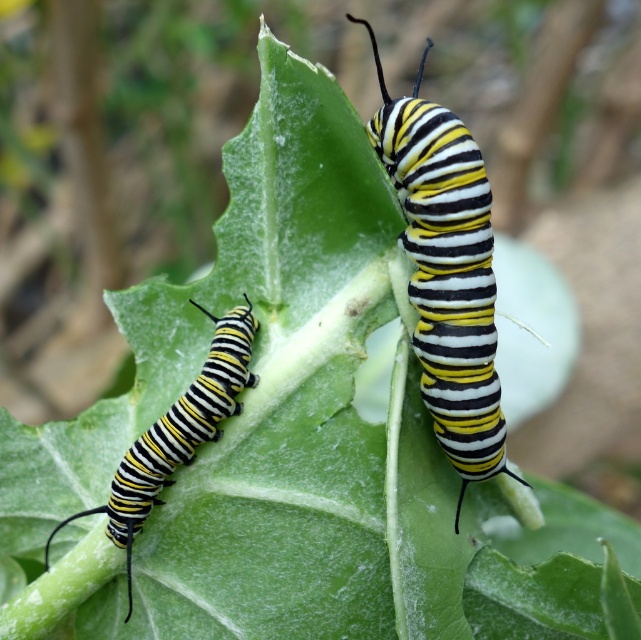
Question: Which of the following is the closest to the observer?

Choices:
 (A) yellow-black-striped caterpillar at center
 (B) yellow-black-striped caterpillar at left

Answer: (A)

Question: Does yellow-black-striped caterpillar at center lie behind yellow-black-striped caterpillar at left?

Choices:
 (A) yes
 (B) no

Answer: (B)

Question: Can you confirm if yellow-black-striped caterpillar at center is positioned below yellow-black-striped caterpillar at left?

Choices:
 (A) yes
 (B) no

Answer: (B)

Question: Which of the following is the closest to the observer?

Choices:
 (A) (135, 518)
 (B) (445, 337)

Answer: (B)

Question: Observing the image, what is the correct spatial positioning of yellow-black-striped caterpillar at center in reference to yellow-black-striped caterpillar at left?

Choices:
 (A) left
 (B) right

Answer: (B)